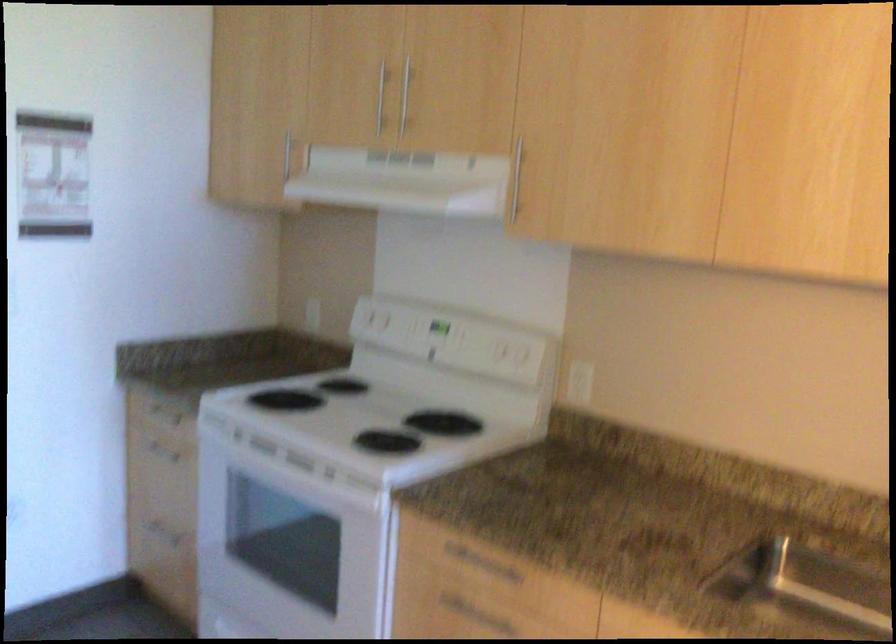
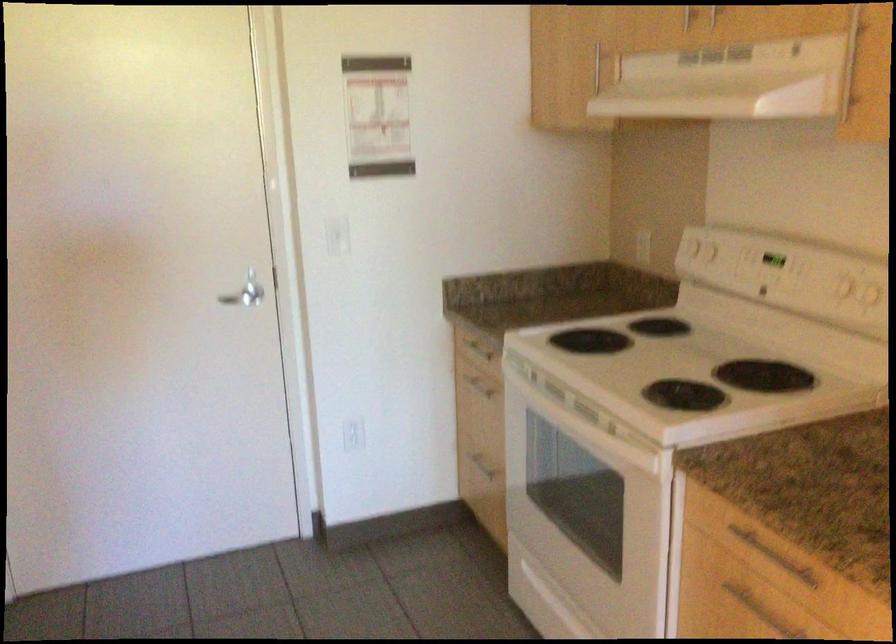
Locate, in the second image, the point that corresponds to point 156,413 in the first image.

(476, 346)